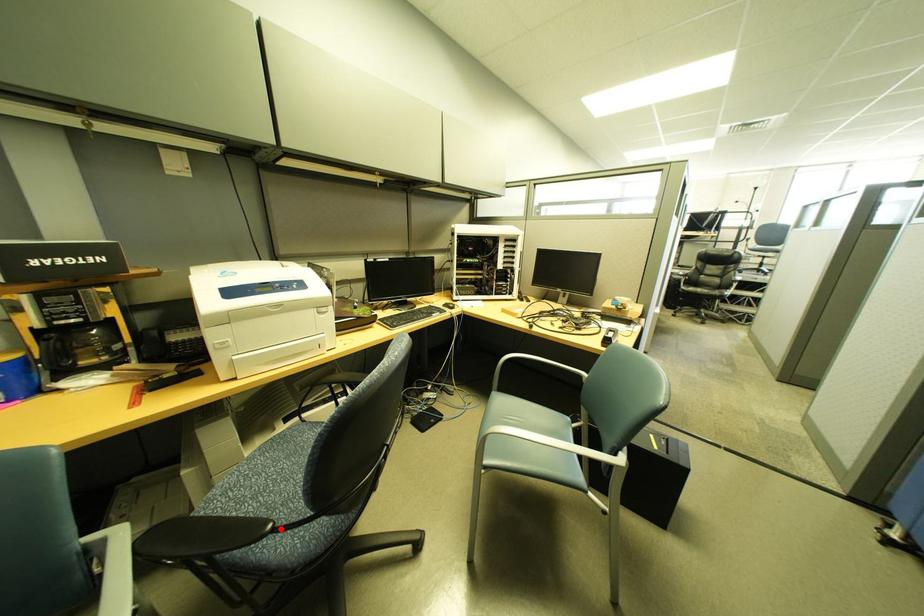
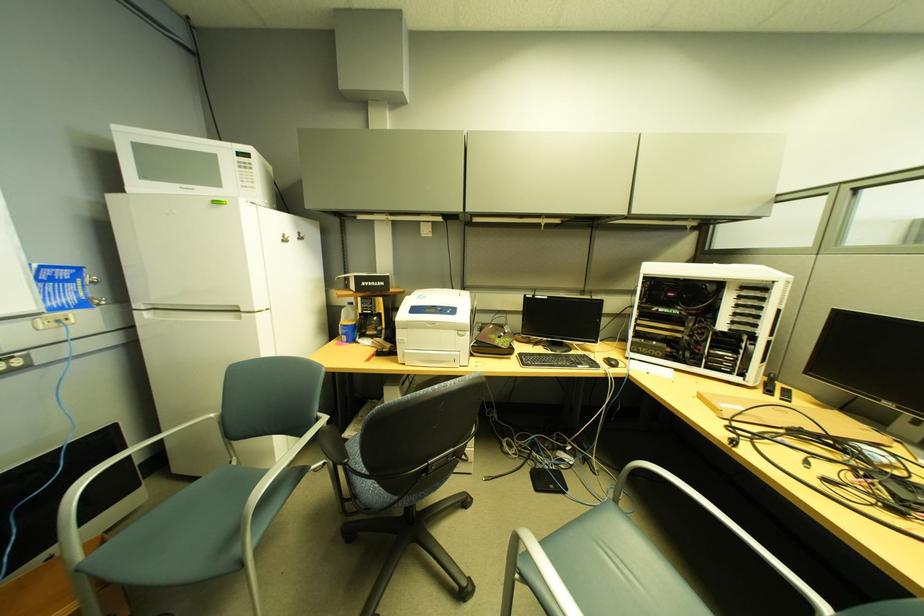
Find the pixel in the second image that matches the highlighted location in the first image.

(357, 464)